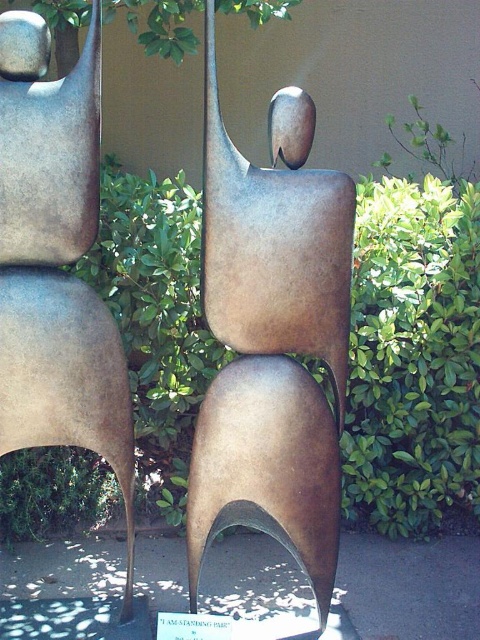
Question: Which of the following is the closest to the observer?

Choices:
 (A) (286, 381)
 (B) (131, 612)

Answer: (A)

Question: Does bronze sculpture at center appear on the right side of matte bronze figure at center?

Choices:
 (A) no
 (B) yes

Answer: (B)

Question: Considering the relative positions of bronze sculpture at center and matte bronze figure at center in the image provided, where is bronze sculpture at center located with respect to matte bronze figure at center?

Choices:
 (A) right
 (B) left

Answer: (A)

Question: Which point is farther from the camera taking this photo?

Choices:
 (A) click(84, 44)
 (B) click(301, 499)

Answer: (A)

Question: Can you confirm if bronze sculpture at center is positioned above matte bronze figure at center?

Choices:
 (A) no
 (B) yes

Answer: (A)

Question: Which object is farther from the camera taking this photo?

Choices:
 (A) bronze sculpture at center
 (B) matte bronze figure at center

Answer: (B)